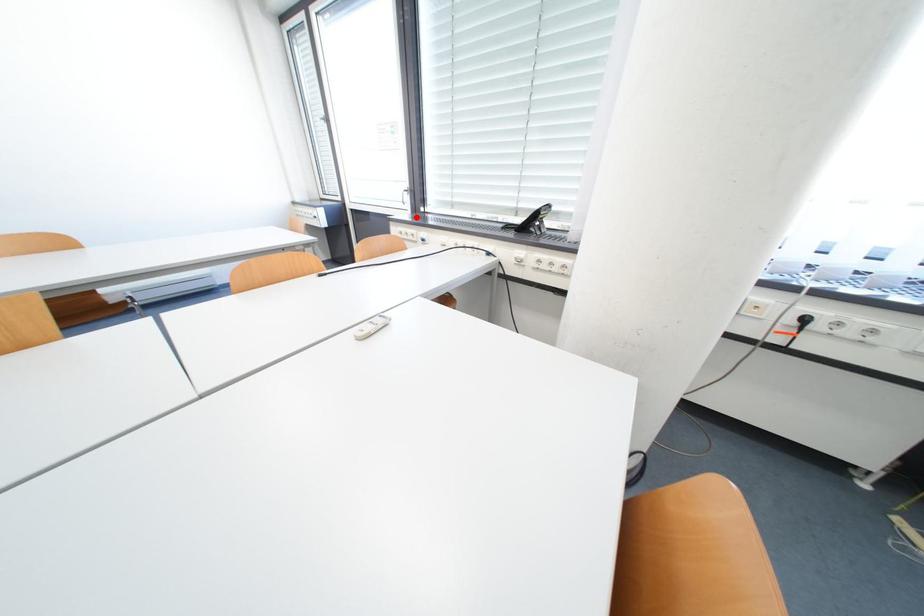
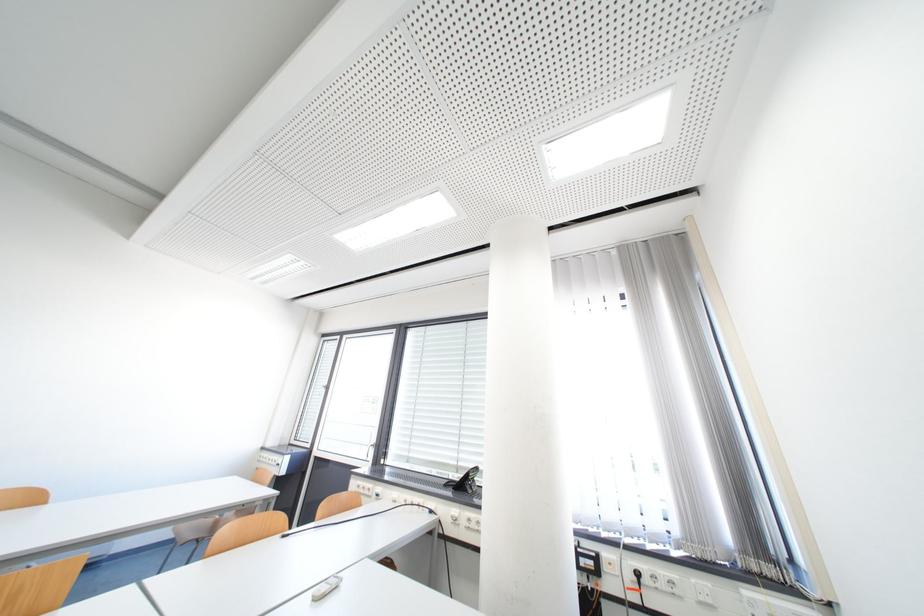
In the second image, find the point that corresponds to the highlighted location in the first image.

(377, 469)